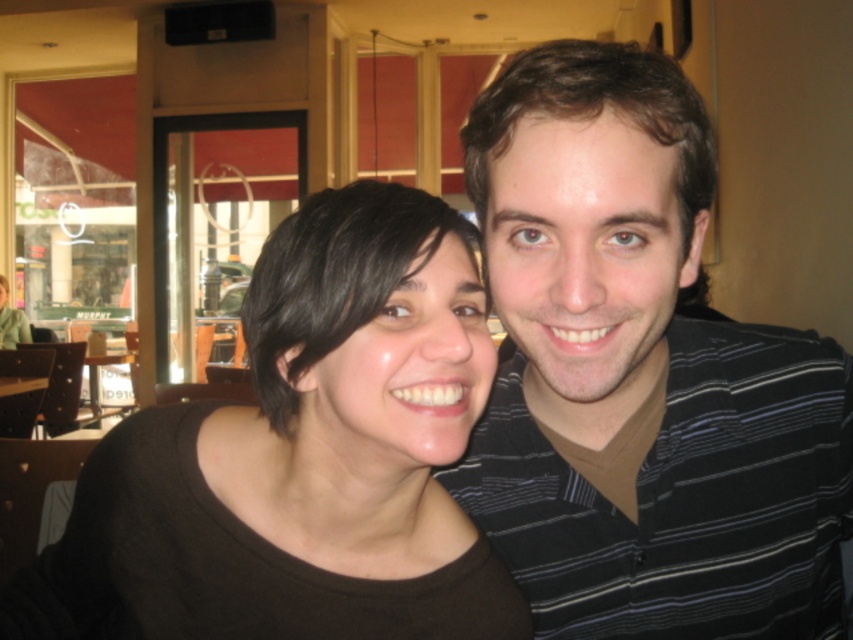
You are taking a photo of the two people in the image. You want to focus on the person closer to the camera. Which point should you adjust your camera focus to, point 1 at position (393, 636) or point 2 at position (4, 305)?

Point 1 at position (393, 636) is closer to the camera than point 2 at position (4, 305), so you should focus on point 1 at position (393, 636).

You are a photographer setting up for a group photo. You need to ensure that both the brown matte shirt at center and the matte black shirt at center are in focus. Given that your camera has a depth of field that can cover 17 feet, will both subjects be in focus?

The brown matte shirt at center and the matte black shirt at center are 16.95 feet apart from each other. Since the distance between them is within the camera depth of field range of 17 feet, both subjects will be in focus.

In the scene shown: You are a photographer trying to capture a clear shot of the matte black shirt at center without the black striped shirt at right blocking it. What adjustment should you make to your camera position?

Move your camera position backward to create more distance between the black striped shirt at right and the matte black shirt at center, allowing the matte black shirt at center to be visible without obstruction.